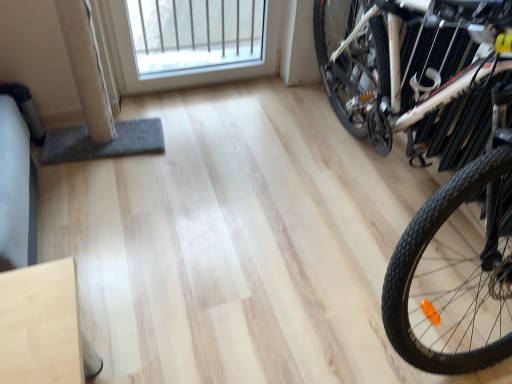
In order to click on white matte bicycle at right in this screenshot , I will do `click(439, 162)`.

The height and width of the screenshot is (384, 512). Describe the element at coordinates (439, 162) in the screenshot. I see `white matte bicycle at right` at that location.

The width and height of the screenshot is (512, 384). Find the location of `white matte bicycle at right`. white matte bicycle at right is located at coordinates (439, 162).